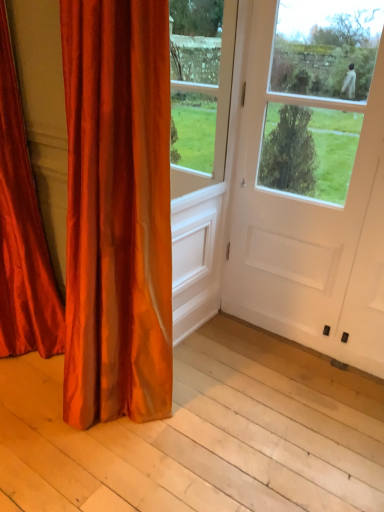
Question: Could you tell me if satin orange curtain at left, the 2th curtain positioned from the left, is turned towards white matte door at center?

Choices:
 (A) yes
 (B) no

Answer: (B)

Question: Is satin orange curtain at left, which appears as the first curtain when viewed from the right, directly adjacent to white matte door at center?

Choices:
 (A) yes
 (B) no

Answer: (B)

Question: Is satin orange curtain at left, the 2th curtain positioned from the left, taller than white matte door at center?

Choices:
 (A) yes
 (B) no

Answer: (B)

Question: Is satin orange curtain at left, the 2th curtain positioned from the left, bigger than white matte door at center?

Choices:
 (A) yes
 (B) no

Answer: (A)

Question: From a real-world perspective, is satin orange curtain at left, which appears as the first curtain when viewed from the right, positioned under white matte door at center based on gravity?

Choices:
 (A) yes
 (B) no

Answer: (A)

Question: Is satin orange curtain at left, the 2th curtain positioned from the left, looking in the opposite direction of white matte door at center?

Choices:
 (A) no
 (B) yes

Answer: (B)

Question: Can you confirm if satin red curtain at left, placed as the second curtain when sorted from right to left, is positioned to the left of satin orange curtain at left, the 2th curtain positioned from the left?

Choices:
 (A) yes
 (B) no

Answer: (A)

Question: Could you tell me if satin red curtain at left, which ranks as the first curtain in left-to-right order, is turned towards satin orange curtain at left, which appears as the first curtain when viewed from the right?

Choices:
 (A) no
 (B) yes

Answer: (A)

Question: From a real-world perspective, is satin red curtain at left, which ranks as the first curtain in left-to-right order, physically above satin orange curtain at left, the 2th curtain positioned from the left?

Choices:
 (A) no
 (B) yes

Answer: (B)

Question: Is satin red curtain at left, placed as the second curtain when sorted from right to left, oriented away from satin orange curtain at left, the 2th curtain positioned from the left?

Choices:
 (A) yes
 (B) no

Answer: (B)

Question: Is satin red curtain at left, placed as the second curtain when sorted from right to left, to the right of satin orange curtain at left, the 2th curtain positioned from the left, from the viewer's perspective?

Choices:
 (A) yes
 (B) no

Answer: (B)

Question: Is satin red curtain at left, placed as the second curtain when sorted from right to left, smaller than satin orange curtain at left, the 2th curtain positioned from the left?

Choices:
 (A) yes
 (B) no

Answer: (B)

Question: From a real-world perspective, is satin orange curtain at left, which appears as the first curtain when viewed from the right, below smooth wood plank at lower left?

Choices:
 (A) no
 (B) yes

Answer: (A)